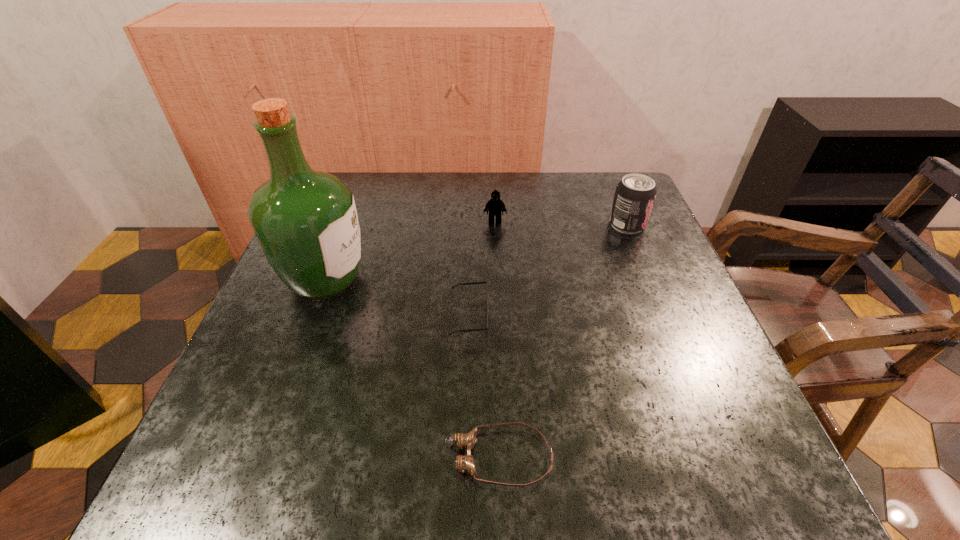
Locate an element on the screen. free space that satisfies the following two spatial constraints: 1. on the face of the Lego; 2. on the front-facing side of the sunglasses is located at coordinates (499, 316).

Where is `vacant space that satisfies the following two spatial constraints: 1. on the face of the third shortest object; 2. on the front-facing side of the second shortest object`? The image size is (960, 540). vacant space that satisfies the following two spatial constraints: 1. on the face of the third shortest object; 2. on the front-facing side of the second shortest object is located at coordinates (499, 316).

Locate an element on the screen. This screenshot has height=540, width=960. vacant space that satisfies the following two spatial constraints: 1. on the face of the Lego; 2. on the front-facing side of the leftmost object is located at coordinates (497, 279).